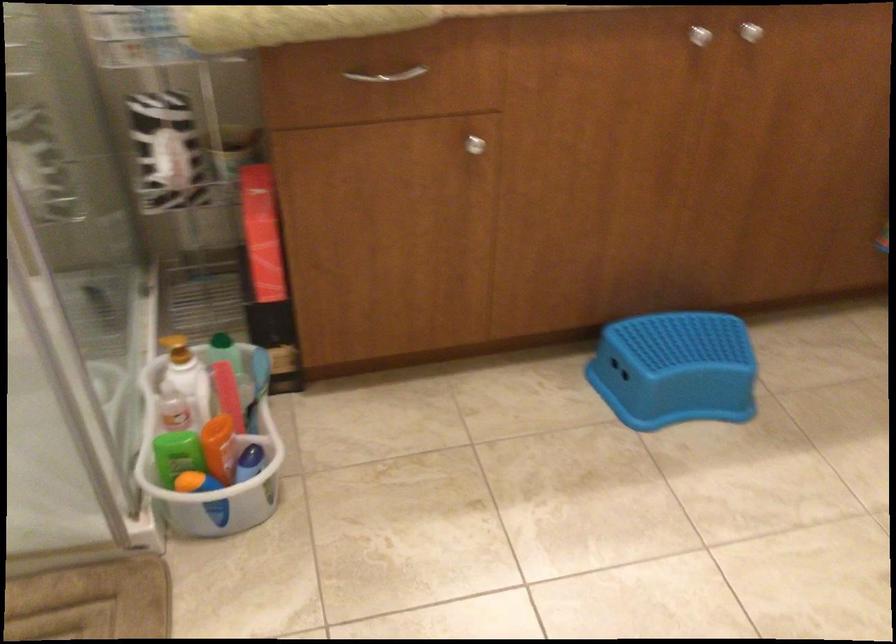
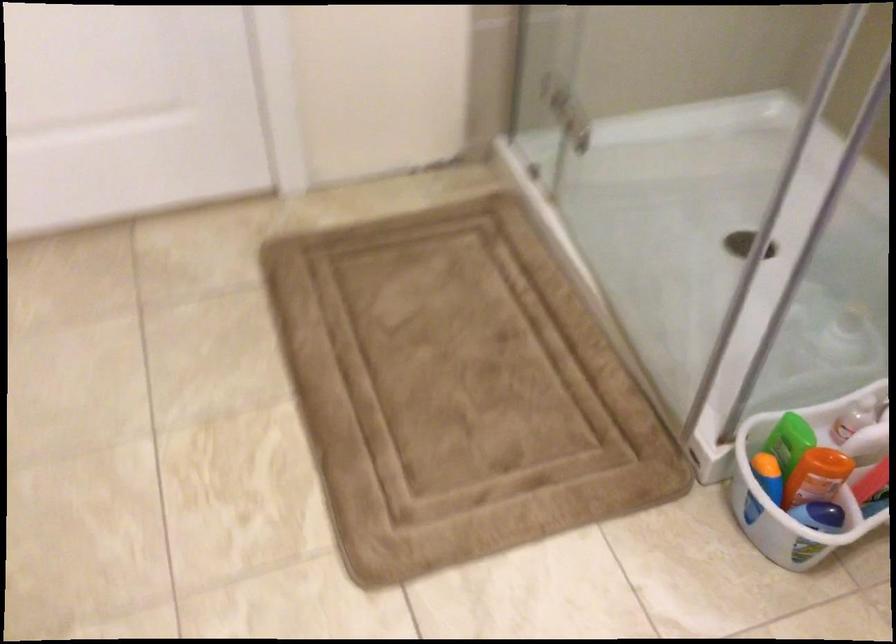
How did the camera likely rotate?

The rotation direction of the camera is left-down.